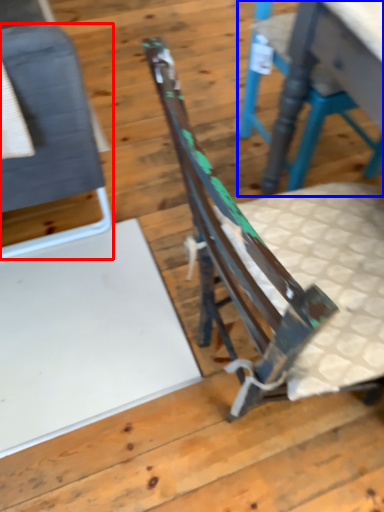
Question: Which object appears closest to the camera in this image, chair (highlighted by a red box) or chair (highlighted by a blue box)?

Choices:
 (A) chair
 (B) chair

Answer: (A)